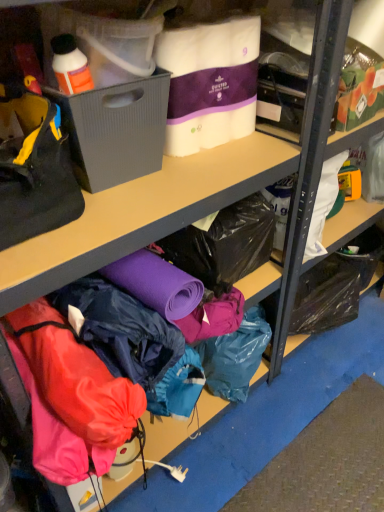
Question: Looking at the image, does black fabric handbag at left seem bigger or smaller compared to white quilted paper towels at upper center, the 2th clothing when ordered from bottom to top?

Choices:
 (A) small
 (B) big

Answer: (B)

Question: In terms of width, does black fabric handbag at left look wider or thinner when compared to white quilted paper towels at upper center, the 1th clothing when ordered from top to bottom?

Choices:
 (A) wide
 (B) thin

Answer: (A)

Question: Estimate the real-world distances between objects in this image. Which object is farther from the waterproof fabric jacket at lower center, the 2th clothing when ordered from top to bottom?

Choices:
 (A) black fabric handbag at left
 (B) white quilted paper towels at upper center, the 1th clothing when ordered from top to bottom
 (C) gray plastic bin at left

Answer: (B)

Question: Considering the real-world distances, which object is closest to the waterproof fabric jacket at lower center, the 2th clothing when ordered from top to bottom?

Choices:
 (A) white quilted paper towels at upper center, the 2th clothing when ordered from bottom to top
 (B) gray plastic bin at left
 (C) black fabric handbag at left

Answer: (C)